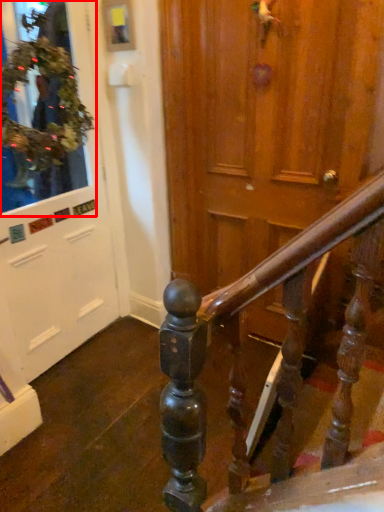
Question: From the image's perspective, what is the correct spatial positioning of shop window (annotated by the red box) in reference to door?

Choices:
 (A) above
 (B) below

Answer: (A)